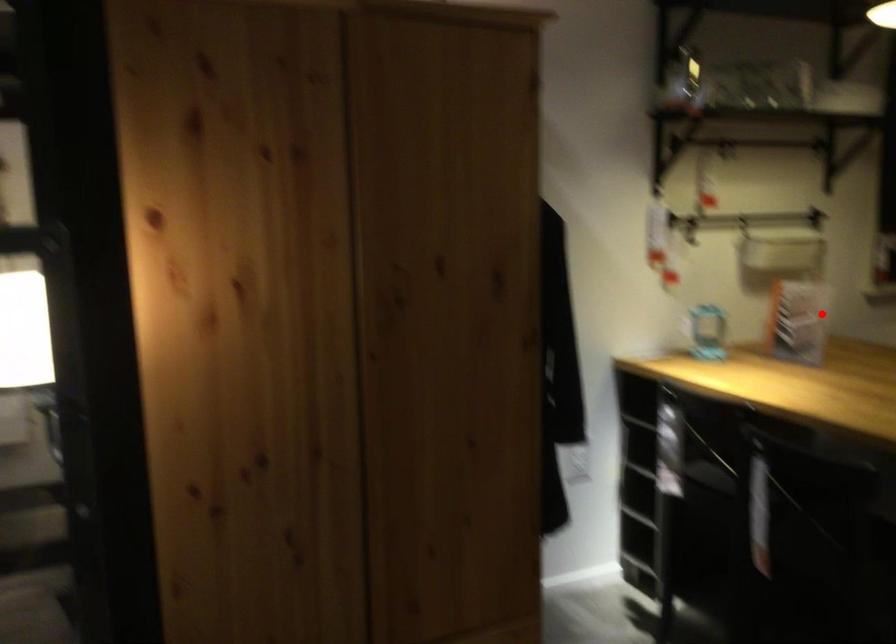
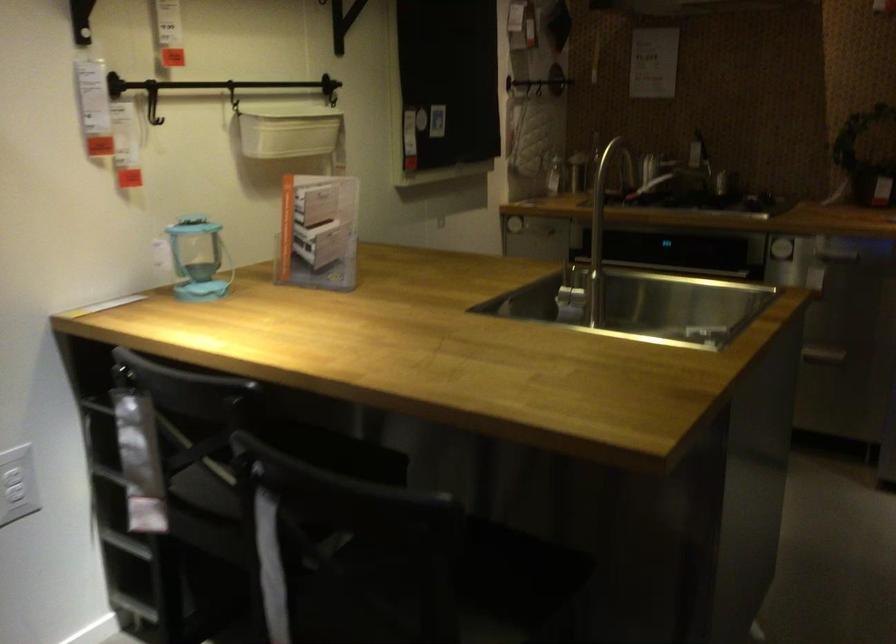
In the second image, find the point that corresponds to the highlighted location in the first image.

(317, 232)